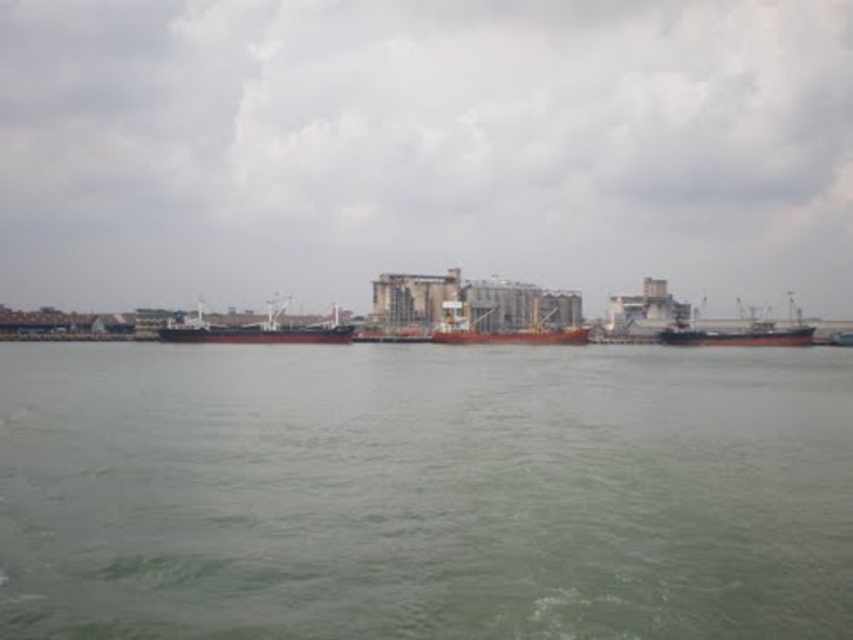
Question: Which of the following is the farthest from the observer?

Choices:
 (A) (561, 333)
 (B) (215, 324)
 (C) (682, 333)
 (D) (358, 561)

Answer: (B)

Question: Based on their relative distances, which object is nearer to the green water at center?

Choices:
 (A) red matte cargo ship at center
 (B) dark gray matte ship at center
 (C) red matte ship at right

Answer: (C)

Question: Which of the following is the farthest from the observer?

Choices:
 (A) red matte ship at right
 (B) red matte cargo ship at center

Answer: (B)

Question: Is green water at center thinner than dark gray matte ship at center?

Choices:
 (A) yes
 (B) no

Answer: (B)

Question: Does green water at center lie in front of red matte ship at right?

Choices:
 (A) no
 (B) yes

Answer: (B)

Question: Is dark gray matte ship at center thinner than red matte ship at right?

Choices:
 (A) no
 (B) yes

Answer: (A)